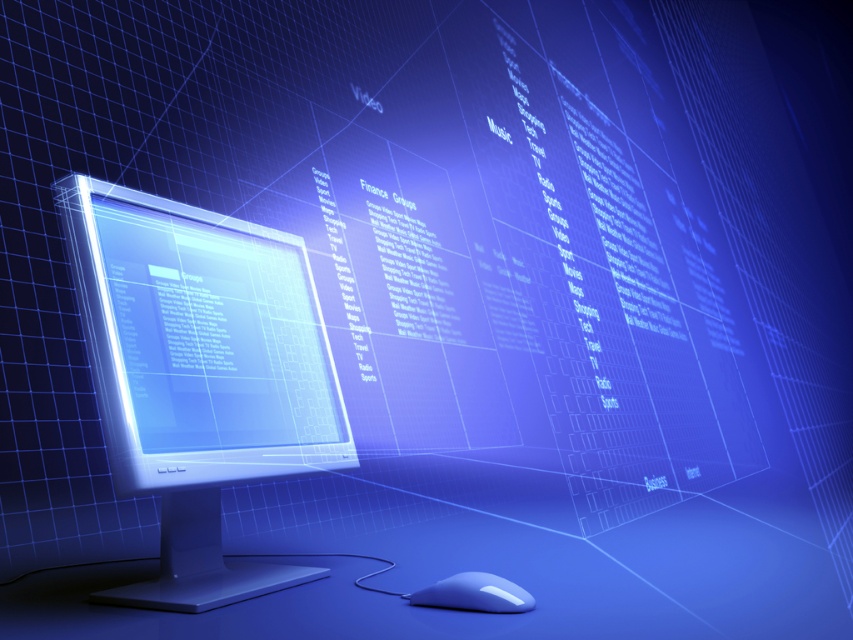
Question: Among these points, which one is farthest from the camera?

Choices:
 (A) (498, 602)
 (B) (129, 465)

Answer: (B)

Question: Which point is farther from the camera taking this photo?

Choices:
 (A) (167, 209)
 (B) (483, 580)

Answer: (A)

Question: Considering the relative positions of satin silver monitor at center and white glossy mouse at lower center in the image provided, where is satin silver monitor at center located with respect to white glossy mouse at lower center?

Choices:
 (A) below
 (B) above

Answer: (B)

Question: Can you confirm if satin silver monitor at center is positioned to the right of white glossy mouse at lower center?

Choices:
 (A) yes
 (B) no

Answer: (B)

Question: Can you confirm if satin silver monitor at center is thinner than white glossy mouse at lower center?

Choices:
 (A) yes
 (B) no

Answer: (B)

Question: Which point is farther to the camera?

Choices:
 (A) white glossy mouse at lower center
 (B) satin silver monitor at center

Answer: (B)